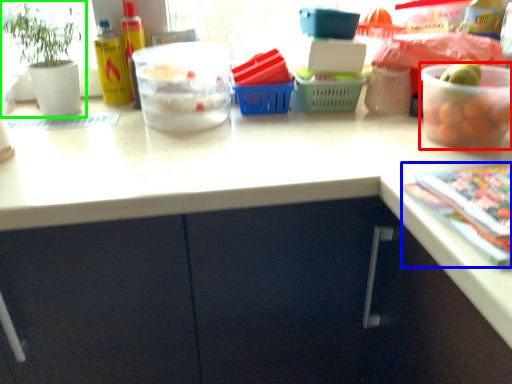
Question: Based on their relative distances, which object is farther from bowl (highlighted by a red box)? Choose from magazine (highlighted by a blue box) and houseplant (highlighted by a green box).

Choices:
 (A) magazine
 (B) houseplant

Answer: (B)